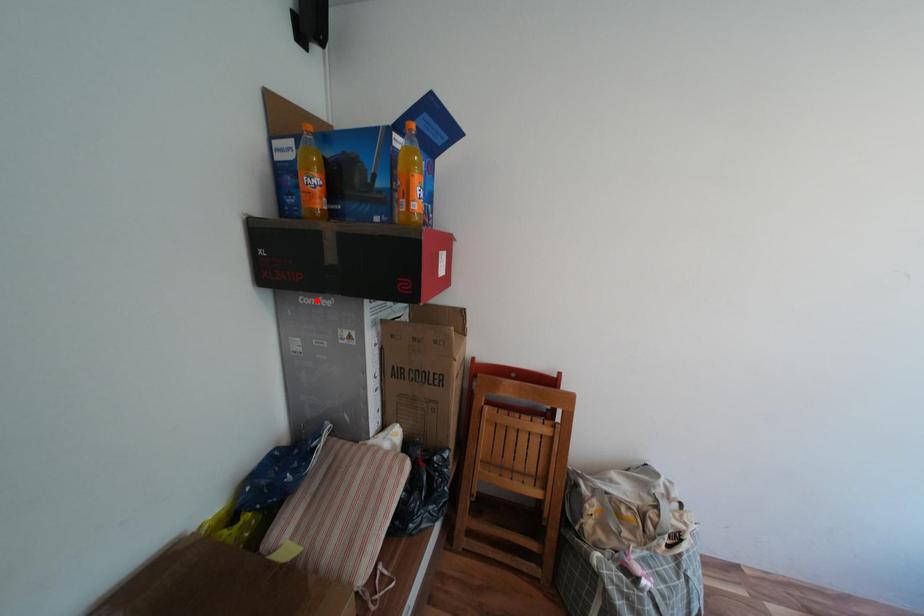
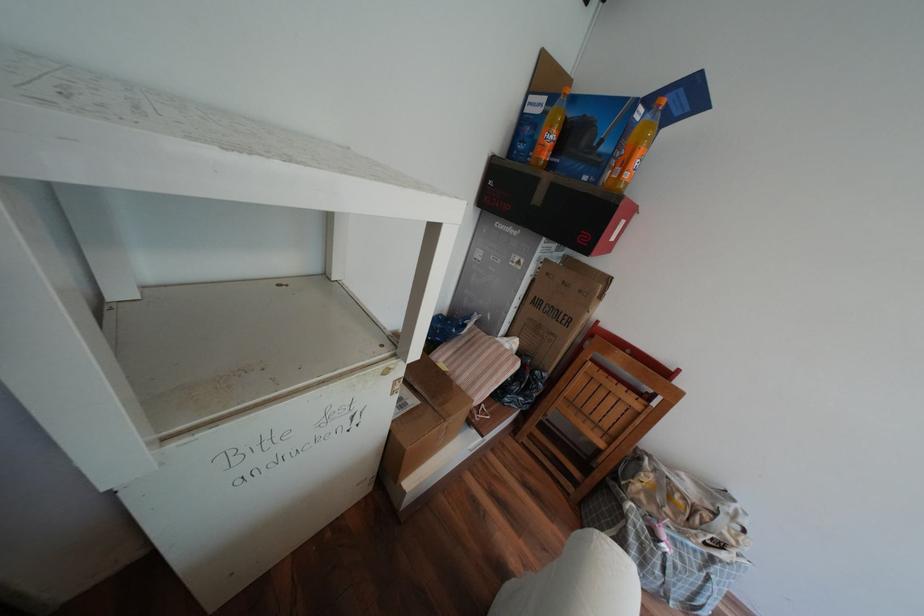
The point at the highlighted location is marked in the first image. Where is the corresponding point in the second image?

(511, 225)